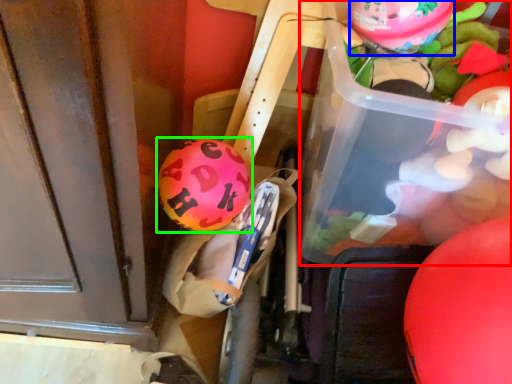
Question: Estimate the real-world distances between objects in this image. Which object is closer to wide (highlighted by a red box), balloon (highlighted by a blue box) or balloon (highlighted by a green box)?

Choices:
 (A) balloon
 (B) balloon

Answer: (A)